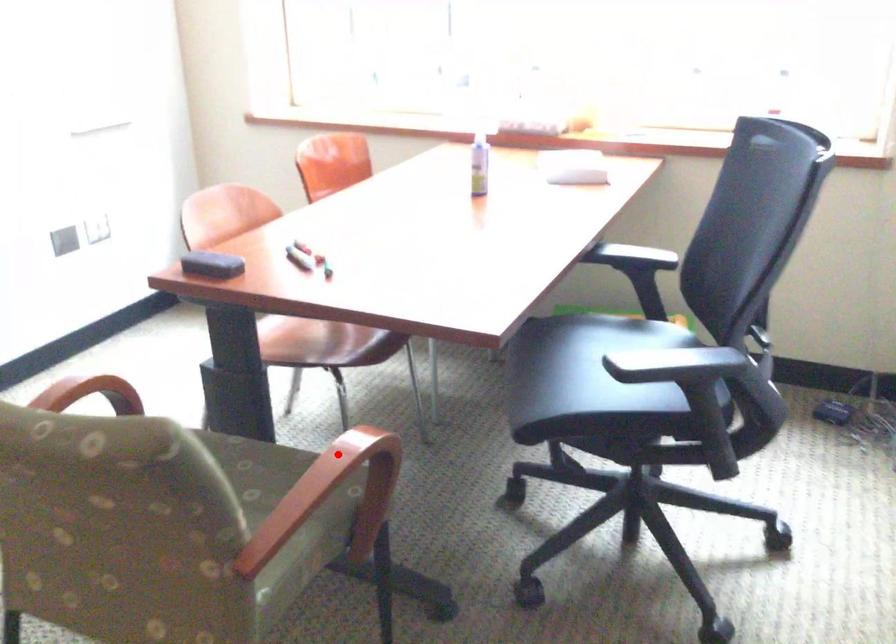
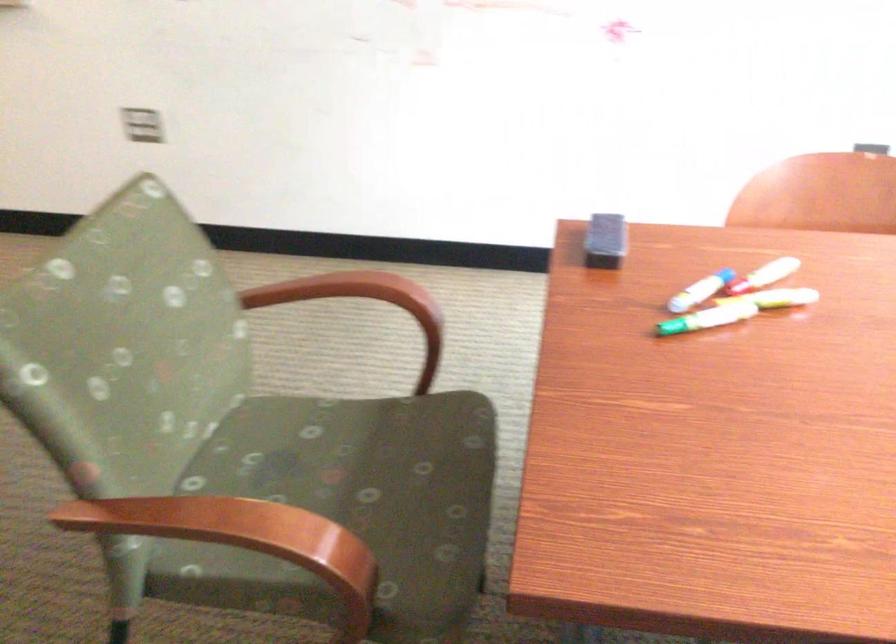
Question: I am providing you with two images of the same scene from different viewpoints. Given a red point in image1, look at the same physical point in image2. Is it:

Choices:
 (A) Closer to the viewpoint
 (B) Farther from the viewpoint

Answer: (A)